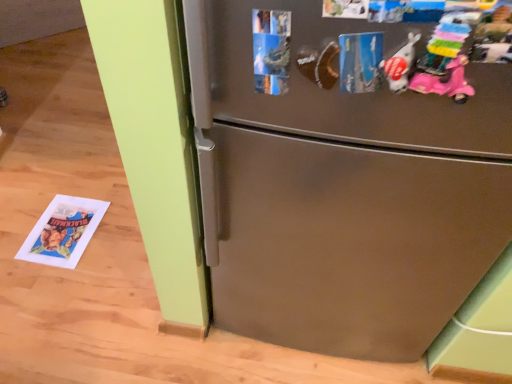
Question: In the image, is pastel plastic toy at upper right, which is counted as the second toy, starting from the left, positioned in front of or behind stainless steel refrigerator at center?

Choices:
 (A) front
 (B) behind

Answer: (A)

Question: From the image's perspective, relative to stainless steel refrigerator at center, is pastel plastic toy at upper right, the 1th toy in the right-to-left sequence, above or below?

Choices:
 (A) below
 (B) above

Answer: (B)

Question: Which of these objects is positioned closest to the pastel plastic toy at upper right, the 1th toy in the right-to-left sequence?

Choices:
 (A) white matte plush toy at upper right, which is the second toy in right-to-left order
 (B) stainless steel refrigerator at center

Answer: (A)

Question: Estimate the real-world distances between objects in this image. Which object is closer to the stainless steel refrigerator at center?

Choices:
 (A) white matte plush toy at upper right, which ranks as the 1th toy in left-to-right order
 (B) pastel plastic toy at upper right, the 1th toy in the right-to-left sequence

Answer: (A)